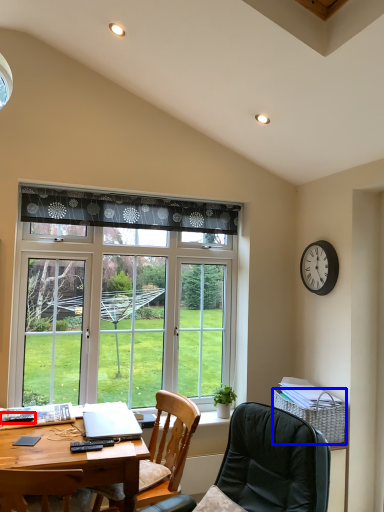
Question: Which object is further to the camera taking this photo, remote control (highlighted by a red box) or picnic basket (highlighted by a blue box)?

Choices:
 (A) remote control
 (B) picnic basket

Answer: (B)